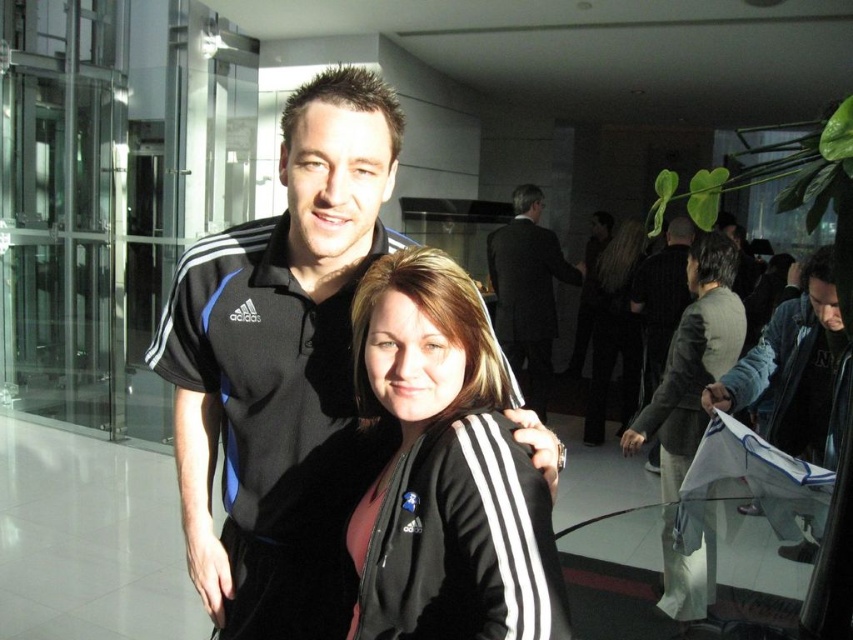
Question: Is black matte jacket at center below black fabric jacket at center?

Choices:
 (A) no
 (B) yes

Answer: (B)

Question: Does dark suit at center come behind black fabric jacket at center?

Choices:
 (A) no
 (B) yes

Answer: (A)

Question: Which object is closer to the camera taking this photo?

Choices:
 (A) black matte jacket at center
 (B) dark gray jacket at center

Answer: (A)

Question: Which of these objects is positioned farthest from the black fabric jacket at center?

Choices:
 (A) black adidas polo shirt at center
 (B) black matte jacket at center
 (C) dark suit at center

Answer: (B)

Question: Does black matte jacket at center appear on the right side of blue denim jacket at right?

Choices:
 (A) no
 (B) yes

Answer: (A)

Question: Which point is closer to the camera?

Choices:
 (A) (291, 298)
 (B) (628, 324)
 (C) (666, 337)
 (D) (791, 401)

Answer: (A)